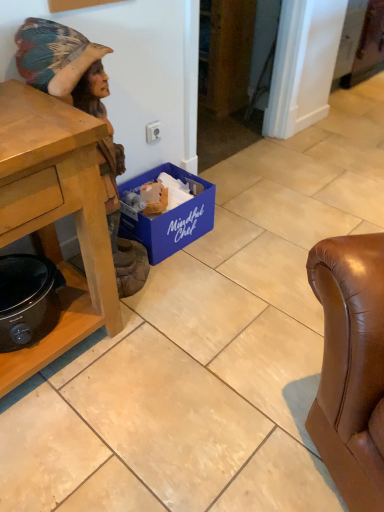
The width and height of the screenshot is (384, 512). Find the location of `black matte slow cooker at lower left`. black matte slow cooker at lower left is located at coordinates (27, 300).

Describe the element at coordinates (27, 300) in the screenshot. I see `black matte slow cooker at lower left` at that location.

What is the approximate width of blue cardboard box at lower center?

blue cardboard box at lower center is 12.85 inches wide.

Locate an element on the screen. The height and width of the screenshot is (512, 384). black matte slow cooker at lower left is located at coordinates coord(27,300).

Would you say blue cardboard box at lower center is part of black matte slow cooker at lower left's contents?

No.

From the image's perspective, is black matte slow cooker at lower left on blue cardboard box at lower center?

Incorrect, from the image's perspective, black matte slow cooker at lower left is lower than blue cardboard box at lower center.

How distant is black matte slow cooker at lower left from blue cardboard box at lower center?

black matte slow cooker at lower left and blue cardboard box at lower center are 23.03 inches apart from each other.

Can you confirm if black matte slow cooker at lower left is wider than blue cardboard box at lower center?

No.

In the scene shown: Is black matte slow cooker at lower left completely or partially inside wooden statue at left?

No, black matte slow cooker at lower left is located outside of wooden statue at left.

Is wooden statue at left thinner than black matte slow cooker at lower left?

No, wooden statue at left is not thinner than black matte slow cooker at lower left.

From a real-world perspective, is wooden statue at left above or below black matte slow cooker at lower left?

wooden statue at left is above black matte slow cooker at lower left.

Between wooden statue at left and black matte slow cooker at lower left, which one is positioned behind?

Positioned behind is black matte slow cooker at lower left.

Who is shorter, blue cardboard box at lower center or wooden statue at left?

blue cardboard box at lower center.

From the image's perspective, is blue cardboard box at lower center on top of wooden statue at left?

No, from the image's perspective, blue cardboard box at lower center is not over wooden statue at left.

Identify the location of person in front of the blue cardboard box at lower center. (62, 64).

Can you confirm if black matte slow cooker at lower left is taller than wooden statue at left?

No, black matte slow cooker at lower left is not taller than wooden statue at left.

Could you tell me if black matte slow cooker at lower left is facing wooden statue at left?

No, black matte slow cooker at lower left is not turned towards wooden statue at left.

How far apart are black matte slow cooker at lower left and wooden statue at left?

They are 16.58 inches apart.

Are black matte slow cooker at lower left and wooden statue at left located far from each other?

Actually, black matte slow cooker at lower left and wooden statue at left are a little close together.

In the image, is blue cardboard box at lower center on the left side or the right side of black matte slow cooker at lower left?

Based on their positions, blue cardboard box at lower center is located to the right of black matte slow cooker at lower left.

Does blue cardboard box at lower center have a smaller size compared to black matte slow cooker at lower left?

No.

What's the angular difference between blue cardboard box at lower center and black matte slow cooker at lower left's facing directions?

The facing directions of blue cardboard box at lower center and black matte slow cooker at lower left are 1.03 degrees apart.

Is blue cardboard box at lower center looking in the opposite direction of black matte slow cooker at lower left?

No, black matte slow cooker at lower left is not at the back of blue cardboard box at lower center.

What's the angular difference between wooden statue at left and blue cardboard box at lower center's facing directions?

0.907 degrees.

Which of these two, wooden statue at left or blue cardboard box at lower center, stands shorter?

blue cardboard box at lower center is shorter.

Is wooden statue at left facing away from blue cardboard box at lower center?

No, wooden statue at left's orientation is not away from blue cardboard box at lower center.

Can we say wooden statue at left lies outside blue cardboard box at lower center?

wooden statue at left is positioned outside blue cardboard box at lower center.

Find the location of a particular element. The image size is (384, 512). box behind the black matte slow cooker at lower left is located at coordinates (169, 217).

I want to click on person to the right of black matte slow cooker at lower left, so click(x=62, y=64).

In the scene shown: Based on their spatial positions, is black matte slow cooker at lower left or wooden statue at left further from blue cardboard box at lower center?

Among the two, black matte slow cooker at lower left is located further to blue cardboard box at lower center.

Based on their spatial positions, is blue cardboard box at lower center or wooden statue at left closer to black matte slow cooker at lower left?

wooden statue at left lies closer to black matte slow cooker at lower left than the other object.

From the image, which object appears to be farther from wooden statue at left, blue cardboard box at lower center or black matte slow cooker at lower left?

black matte slow cooker at lower left.

Which object lies further to the anchor point blue cardboard box at lower center, wooden statue at left or black matte slow cooker at lower left?

The object further to blue cardboard box at lower center is black matte slow cooker at lower left.

Based on their spatial positions, is wooden statue at left or blue cardboard box at lower center further from black matte slow cooker at lower left?

Based on the image, blue cardboard box at lower center appears to be further to black matte slow cooker at lower left.

Which object lies further to the anchor point wooden statue at left, black matte slow cooker at lower left or blue cardboard box at lower center?

Among the two, black matte slow cooker at lower left is located further to wooden statue at left.

Where is `appliance located between wooden statue at left and blue cardboard box at lower center in the depth direction`? This screenshot has width=384, height=512. appliance located between wooden statue at left and blue cardboard box at lower center in the depth direction is located at coordinates (27, 300).